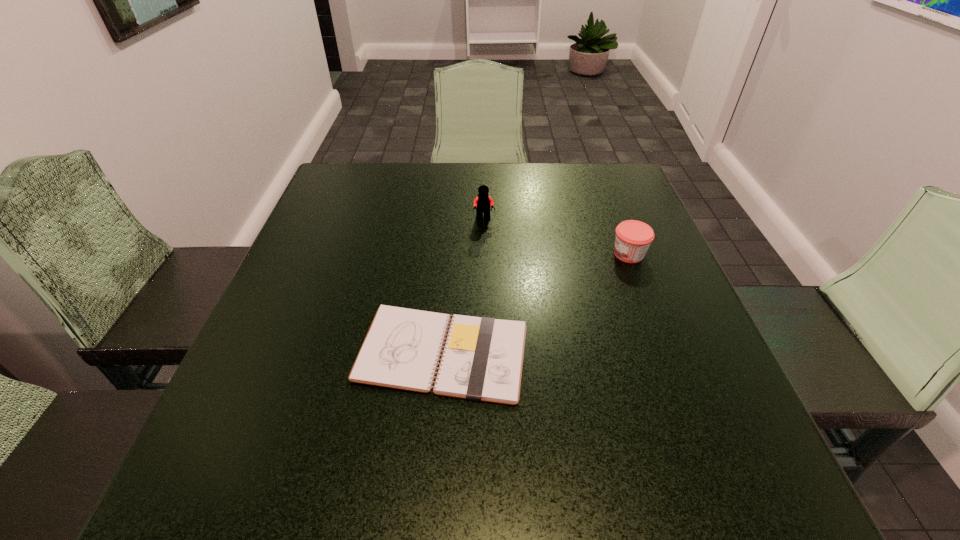
Where is `empty location between the second farthest object and the farthest object`? empty location between the second farthest object and the farthest object is located at coordinates (557, 237).

I want to click on empty space between the notepad and the Lego, so click(464, 286).

Where is `free space between the Lego and the jam`? This screenshot has height=540, width=960. free space between the Lego and the jam is located at coordinates (557, 237).

At what (x,y) coordinates should I click in order to perform the action: click on vacant area that lies between the Lego and the notepad. Please return your answer as a coordinate pair (x, y). Looking at the image, I should click on (464, 286).

Locate an element on the screen. vacant area that lies between the second shortest object and the tallest object is located at coordinates (557, 237).

Where is `vacant area that lies between the Lego and the shortest object`? The height and width of the screenshot is (540, 960). vacant area that lies between the Lego and the shortest object is located at coordinates (464, 286).

The height and width of the screenshot is (540, 960). Find the location of `unoccupied area between the shortest object and the second nearest object`. unoccupied area between the shortest object and the second nearest object is located at coordinates (536, 303).

You are a GUI agent. You are given a task and a screenshot of the screen. Output one action in this format:
    pyautogui.click(x=<x>, y=<y>)
    Task: Click on the object that is the closest one to the nearest object
    This screenshot has height=540, width=960.
    Given the screenshot: What is the action you would take?
    pyautogui.click(x=633, y=238)

Image resolution: width=960 pixels, height=540 pixels. I want to click on object that is the closest one to the shortest object, so click(633, 238).

Locate an element on the screen. The height and width of the screenshot is (540, 960). vacant position in the image that satisfies the following two spatial constraints: 1. on the front label of the jam; 2. on the front side of the shortest object is located at coordinates (666, 353).